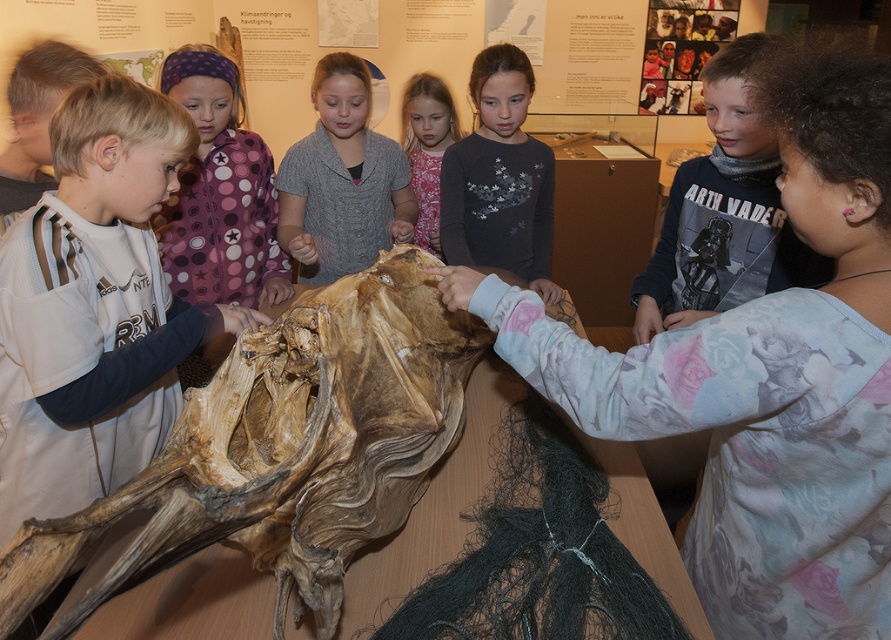
Is matte brown skull at center positioned in front of gray matte sweater at center?

Yes, matte brown skull at center is closer to the viewer.

Is point (746, 500) positioned in front of point (350, 227)?

Yes, it is in front of point (350, 227).

Between point (853, 608) and point (337, 77), which one is positioned behind?

Positioned behind is point (337, 77).

Where is `matte brown skull at center`? matte brown skull at center is located at coordinates (765, 380).

Who is more distant from viewer, (658,291) or (298,186)?

The point (298,186) is more distant.

You are a GUI agent. You are given a task and a screenshot of the screen. Output one action in this format:
    pyautogui.click(x=<x>, y=<y>)
    Task: Click on the dark gray cotton shirt at center
    The image size is (891, 640).
    Given the screenshot: What is the action you would take?
    pyautogui.click(x=724, y=211)

Who is more forward, (659, 276) or (333, 122)?

Point (659, 276) is more forward.

Locate an element on the screen. dark gray cotton shirt at center is located at coordinates (724, 211).

Is matte white shirt at left behind pink floral dress at center?

No.

The height and width of the screenshot is (640, 891). What do you see at coordinates (94, 307) in the screenshot?
I see `matte white shirt at left` at bounding box center [94, 307].

Find the location of a particular element. matte white shirt at left is located at coordinates (94, 307).